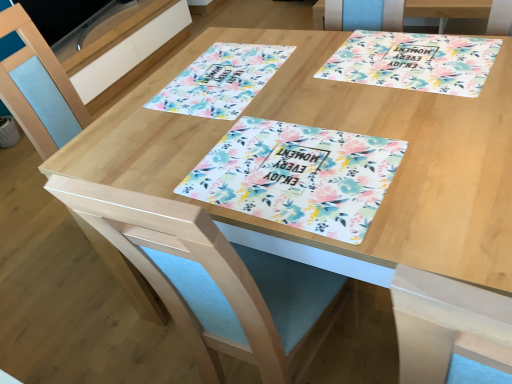
Locate an element on the screen. vacant space in front of floral paper placemat at upper center, acting as the second flyer starting from the front is located at coordinates (242, 135).